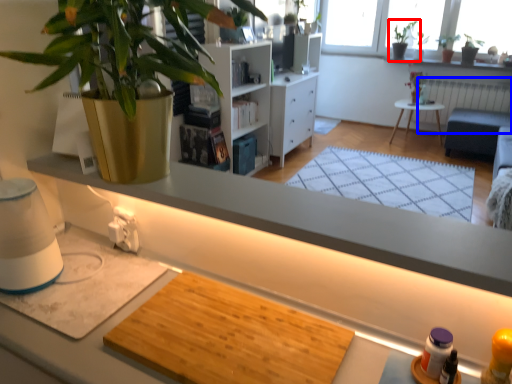
Question: Which object is further to the camera taking this photo, houseplant (highlighted by a red box) or radiator (highlighted by a blue box)?

Choices:
 (A) houseplant
 (B) radiator

Answer: (A)